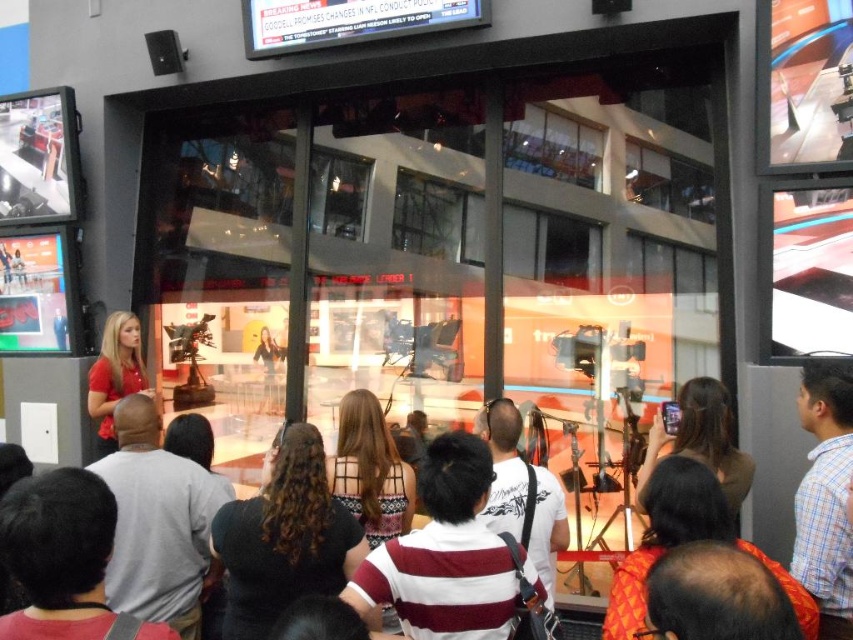
You are organizing a photo shoot and need to position two models wearing the striped cotton shirt at center and the blue plaid shirt at right. Based on the scene description, which model should you place closer to the camera to ensure both are visible in the frame?

The striped cotton shirt at center should be placed closer to the camera because it occupies less space than the blue plaid shirt at right, allowing both models to fit within the frame.

You are a photographer positioned at the camera location. You want to take a photo that includes both point (480,525) and point (839,506). Which point will appear larger in the photo?

Point (480,525) is closer to the camera than point (839,506), so it will appear larger in the photo.

You are a photographer positioned in the studio and need to capture both the white striped shirt at center and the matte red shirt at center in a single shot. Which shirt should you focus on first to ensure both are in frame?

The white striped shirt at center is positioned under the matte red shirt at center, so you should focus on the matte red shirt at center first to ensure both are in frame.